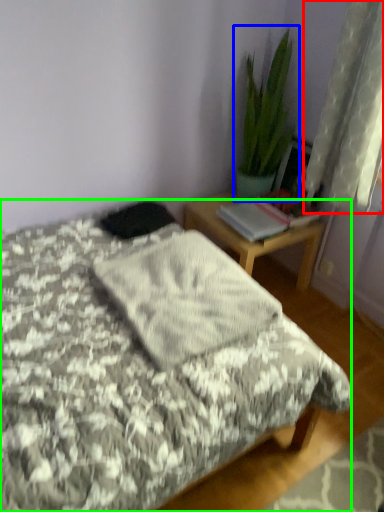
Question: Considering the real-world distances, which object is closest to curtain (highlighted by a red box)? houseplant (highlighted by a blue box) or bed (highlighted by a green box).

Choices:
 (A) houseplant
 (B) bed

Answer: (A)